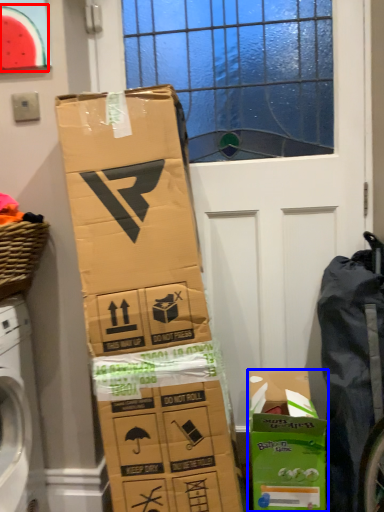
Question: Which object is further to the camera taking this photo, watermelon (highlighted by a red box) or cardboard box (highlighted by a blue box)?

Choices:
 (A) watermelon
 (B) cardboard box

Answer: (A)